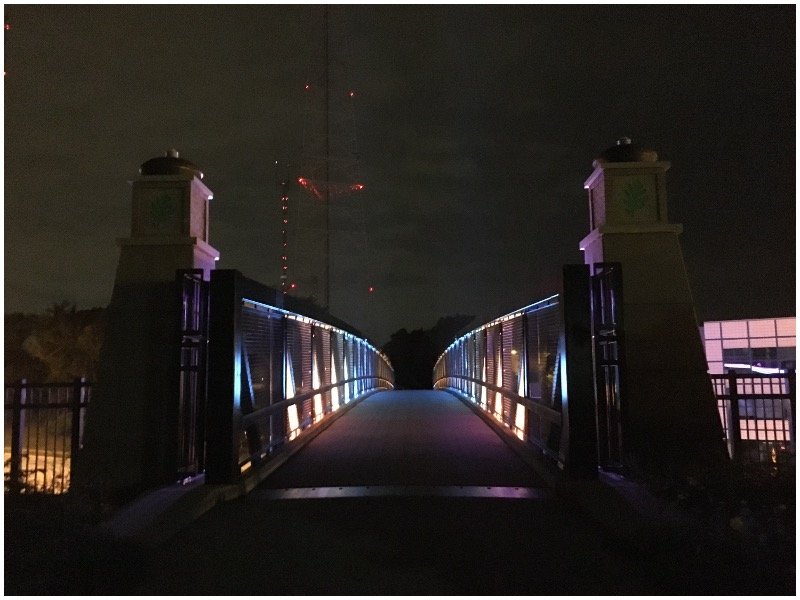
What are the coordinates of `window` in the screenshot? It's located at (760, 353).